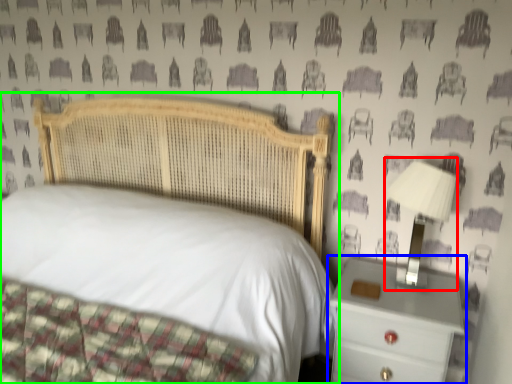
Question: Which object is the farthest from bedside lamp (highlighted by a red box)? Choose among these: nightstand (highlighted by a blue box) or bed (highlighted by a green box).

Choices:
 (A) nightstand
 (B) bed

Answer: (B)